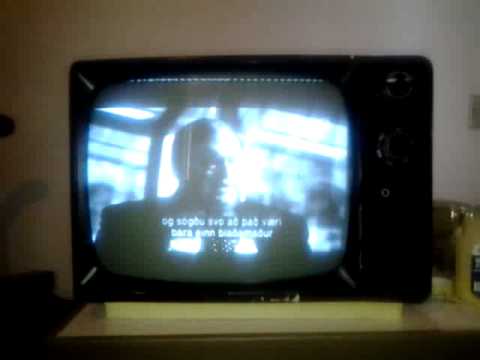
The image size is (480, 360). Identify the location of wall. (180, 31).